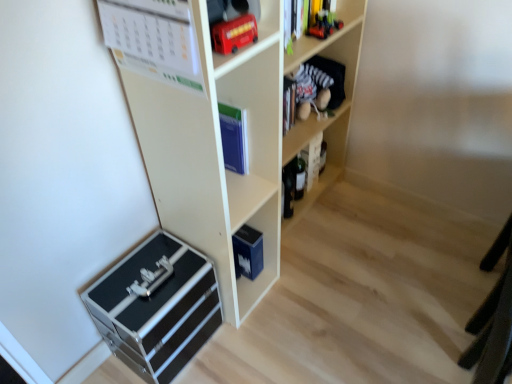
How much space does matte black book at center right, acting as the 1th book starting from the right, occupy horizontally?

It is 2.68 inches.

Looking at this image, in order to face metallic red toy bus at upper right, which ranks as the fourth shelf in bottom-to-top order, should I rotate leftwards or rightwards?

→ Rotate your view right by about 5.843°.

Identify the location of metallic red toy bus at upper right, which ranks as the fourth shelf in bottom-to-top order. Image resolution: width=512 pixels, height=384 pixels. (328, 36).

Describe the element at coordinates (324, 25) in the screenshot. The width and height of the screenshot is (512, 384). I see `metallic red toy car at upper right, marked as the 1th toy in a top-to-bottom arrangement` at that location.

Where is `matte black toolbox at lower left, which is the 3th shelf in top-to-bottom order`? matte black toolbox at lower left, which is the 3th shelf in top-to-bottom order is located at coordinates click(x=220, y=129).

At what (x,y) coordinates should I click in order to perform the action: click on matte black book at center right, the 2th book positioned from the left. Please return your answer as a coordinate pair (x, y). This screenshot has height=384, width=512. Looking at the image, I should click on (312, 160).

Who is shorter, matte black toolbox at lower left, placed as the second shelf when sorted from bottom to top, or metallic red bus at upper center, the first toy viewed from the left?

metallic red bus at upper center, the first toy viewed from the left, is shorter.

Is matte black toolbox at lower left, placed as the second shelf when sorted from bottom to top, at the right side of metallic red bus at upper center, the first toy viewed from the left?

Incorrect, matte black toolbox at lower left, placed as the second shelf when sorted from bottom to top, is not on the right side of metallic red bus at upper center, the first toy viewed from the left.

Which is more distant, (259, 120) or (229, 24)?

The point (259, 120) is farther.

Is metallic red bus at upper center, marked as the 1th toy in a bottom-to-top arrangement, facing away from black metallic toolbox at lower left, the first shelf when ordered from bottom to top?

metallic red bus at upper center, marked as the 1th toy in a bottom-to-top arrangement, is not turned away from black metallic toolbox at lower left, the first shelf when ordered from bottom to top.

From the image's perspective, is metallic red bus at upper center, the first toy viewed from the left, located beneath black metallic toolbox at lower left, the first shelf when ordered from bottom to top?

Actually, metallic red bus at upper center, the first toy viewed from the left, appears above black metallic toolbox at lower left, the first shelf when ordered from bottom to top, in the image.

Is metallic red bus at upper center, the second toy from the right, behind black metallic toolbox at lower left, which appears as the 4th shelf when viewed from the top?

No, metallic red bus at upper center, the second toy from the right, is in front of black metallic toolbox at lower left, which appears as the 4th shelf when viewed from the top.

Which object is thinner, metallic red bus at upper center, arranged as the 2th toy when viewed from the top, or black metallic toolbox at lower left, the first shelf when ordered from bottom to top?

metallic red bus at upper center, arranged as the 2th toy when viewed from the top, is thinner.

From a real-world perspective, relative to metallic red toy car at upper right, marked as the 1th toy in a top-to-bottom arrangement, is black metallic toolbox at lower left, which appears as the 4th shelf when viewed from the top, vertically above or below?

From a real-world perspective, black metallic toolbox at lower left, which appears as the 4th shelf when viewed from the top, is physically below metallic red toy car at upper right, marked as the 1th toy in a top-to-bottom arrangement.

Considering the relative sizes of black metallic toolbox at lower left, which appears as the 4th shelf when viewed from the top, and metallic red toy car at upper right, marked as the 1th toy in a top-to-bottom arrangement, in the image provided, is black metallic toolbox at lower left, which appears as the 4th shelf when viewed from the top, wider than metallic red toy car at upper right, marked as the 1th toy in a top-to-bottom arrangement,?

Yes.

Considering the relative sizes of black metallic toolbox at lower left, which appears as the 4th shelf when viewed from the top, and metallic red toy car at upper right, the 2th toy ordered from the bottom, in the image provided, is black metallic toolbox at lower left, which appears as the 4th shelf when viewed from the top, shorter than metallic red toy car at upper right, the 2th toy ordered from the bottom,?

In fact, black metallic toolbox at lower left, which appears as the 4th shelf when viewed from the top, may be taller than metallic red toy car at upper right, the 2th toy ordered from the bottom.

Would you consider black metallic toolbox at lower left, which appears as the 4th shelf when viewed from the top, to be distant from metallic red toy car at upper right, marked as the 1th toy in a top-to-bottom arrangement?

Yes.

Which object is thinner, blue matte book at center or matte black toolbox at lower left, placed as the second shelf when sorted from bottom to top?

blue matte book at center is thinner.

Are blue matte book at center and matte black toolbox at lower left, placed as the second shelf when sorted from bottom to top, located far from each other?

blue matte book at center is actually quite close to matte black toolbox at lower left, placed as the second shelf when sorted from bottom to top.

From a real-world perspective, who is located lower, blue matte book at center or matte black toolbox at lower left, placed as the second shelf when sorted from bottom to top?

matte black toolbox at lower left, placed as the second shelf when sorted from bottom to top, from a real-world perspective.

In order to click on toy that is the 2nd object to the right of the matte black toolbox at lower left, placed as the second shelf when sorted from bottom to top, starting at the anchor in this screenshot , I will do `click(324, 25)`.

Which point is more distant from viewer, (314, 33) or (197, 13)?

Positioned behind is point (314, 33).

Which is more to the left, metallic red toy car at upper right, the 2th toy positioned from the front, or matte black toolbox at lower left, placed as the second shelf when sorted from bottom to top?

matte black toolbox at lower left, placed as the second shelf when sorted from bottom to top.

At what (x,y) coordinates should I click in order to perform the action: click on book lying in front of the black metallic toolbox at lower left, which appears as the 4th shelf when viewed from the top. Please return your answer as a coordinate pair (x, y). This screenshot has width=512, height=384. Looking at the image, I should click on (154, 40).

Is white paper calendar at upper left, the second book viewed from the back, further to camera compared to black metallic toolbox at lower left, the first shelf when ordered from bottom to top?

That is False.

Considering the relative positions of white paper calendar at upper left, the second book viewed from the right, and black metallic toolbox at lower left, the first shelf when ordered from bottom to top, in the image provided, is white paper calendar at upper left, the second book viewed from the right, to the right of black metallic toolbox at lower left, the first shelf when ordered from bottom to top, from the viewer's perspective?

Yes.

Is white paper calendar at upper left, the second book viewed from the right, facing away from black metallic toolbox at lower left, which appears as the 4th shelf when viewed from the top?

white paper calendar at upper left, the second book viewed from the right, is not turned away from black metallic toolbox at lower left, which appears as the 4th shelf when viewed from the top.

In the scene shown: Is blue matte book at center turned away from matte black book at center right, acting as the 1th book starting from the right?

That's not correct — blue matte book at center is not looking away from matte black book at center right, acting as the 1th book starting from the right.

Considering the relative sizes of blue matte book at center and matte black book at center right, acting as the 1th book starting from the right, in the image provided, is blue matte book at center smaller than matte black book at center right, acting as the 1th book starting from the right,?

Indeed, blue matte book at center has a smaller size compared to matte black book at center right, acting as the 1th book starting from the right.

Considering the sizes of blue matte book at center and matte black book at center right, which is counted as the 1th book, starting from the back, in the image, is blue matte book at center taller or shorter than matte black book at center right, which is counted as the 1th book, starting from the back,?

Considering their sizes, blue matte book at center has less height than matte black book at center right, which is counted as the 1th book, starting from the back.

At what (x,y) coordinates should I click in order to perform the action: click on paperback book above the matte black book at center right, the 2th book positioned from the left (from the image's perspective). Please return your answer as a coordinate pair (x, y). Looking at the image, I should click on (234, 138).

The width and height of the screenshot is (512, 384). Identify the location of the 1st shelf below the metallic red bus at upper center, marked as the 1th toy in a bottom-to-top arrangement (from the image's perspective). (220, 129).

The image size is (512, 384). Identify the location of the 1st toy above the black metallic toolbox at lower left, which appears as the 4th shelf when viewed from the top (from the image's perspective). (234, 34).

Looking at the image, which one is located closer to white paper calendar at upper left, the first book from the front, metallic red bus at upper center, the first toy in the front-to-back sequence, or velvet plush toy at upper right, which ranks as the third shelf in bottom-to-top order?

metallic red bus at upper center, the first toy in the front-to-back sequence, is positioned closer to the anchor white paper calendar at upper left, the first book from the front.

Estimate the real-world distances between objects in this image. Which object is further from black metallic toolbox at lower left, which appears as the 4th shelf when viewed from the top, matte black toolbox at lower left, placed as the second shelf when sorted from bottom to top, or metallic red bus at upper center, marked as the 1th toy in a bottom-to-top arrangement?

The object further to black metallic toolbox at lower left, which appears as the 4th shelf when viewed from the top, is metallic red bus at upper center, marked as the 1th toy in a bottom-to-top arrangement.

Which object lies nearer to the anchor point metallic red bus at upper center, the first toy in the front-to-back sequence, blue matte book at center or white paper calendar at upper left, the first book from the front?

Based on the image, white paper calendar at upper left, the first book from the front, appears to be nearer to metallic red bus at upper center, the first toy in the front-to-back sequence.

Based on their spatial positions, is metallic red bus at upper center, the first toy in the front-to-back sequence, or blue matte book at center closer to velvet plush toy at upper right, which ranks as the third shelf in bottom-to-top order?

Based on the image, blue matte book at center appears to be nearer to velvet plush toy at upper right, which ranks as the third shelf in bottom-to-top order.

Looking at the image, which one is located further to metallic red toy car at upper right, which appears as the 1th toy when viewed from the back, velvet plush toy at upper right, the second shelf positioned from the top, or blue matte book at center?

blue matte book at center is positioned further to the anchor metallic red toy car at upper right, which appears as the 1th toy when viewed from the back.

Based on their spatial positions, is blue matte book at center or metallic red toy car at upper right, the first toy positioned from the right, closer to matte black book at center right, acting as the second book starting from the front?

Based on the image, metallic red toy car at upper right, the first toy positioned from the right, appears to be nearer to matte black book at center right, acting as the second book starting from the front.

Estimate the real-world distances between objects in this image. Which object is closer to velvet plush toy at upper right, which ranks as the third shelf in bottom-to-top order, matte black toolbox at lower left, which is the 3th shelf in top-to-bottom order, or blue matte book at center?

blue matte book at center lies closer to velvet plush toy at upper right, which ranks as the third shelf in bottom-to-top order, than the other object.

Which object lies nearer to the anchor point blue matte book at center, white paper calendar at upper left, the second book viewed from the right, or black metallic toolbox at lower left, which appears as the 4th shelf when viewed from the top?

white paper calendar at upper left, the second book viewed from the right.

The image size is (512, 384). I want to click on toy between metallic red bus at upper center, the first toy viewed from the left, and matte black book at center right, the 2th book positioned from the left, in the front-back direction, so click(324, 25).

Find the location of `paperback book that lies between metallic red toy bus at upper right, placed as the first shelf when sorted from top to bottom, and black metallic toolbox at lower left, the first shelf when ordered from bottom to top, from top to bottom`. paperback book that lies between metallic red toy bus at upper right, placed as the first shelf when sorted from top to bottom, and black metallic toolbox at lower left, the first shelf when ordered from bottom to top, from top to bottom is located at coordinates (234, 138).

Find the location of a particular element. This screenshot has height=384, width=512. toy between white paper calendar at upper left, the second book viewed from the right, and metallic red toy car at upper right, the 2th toy positioned from the front, from front to back is located at coordinates (234, 34).

This screenshot has width=512, height=384. Identify the location of paperback book between metallic red bus at upper center, arranged as the 2th toy when viewed from the top, and matte black book at center right, acting as the 1th book starting from the right, from front to back. (234, 138).